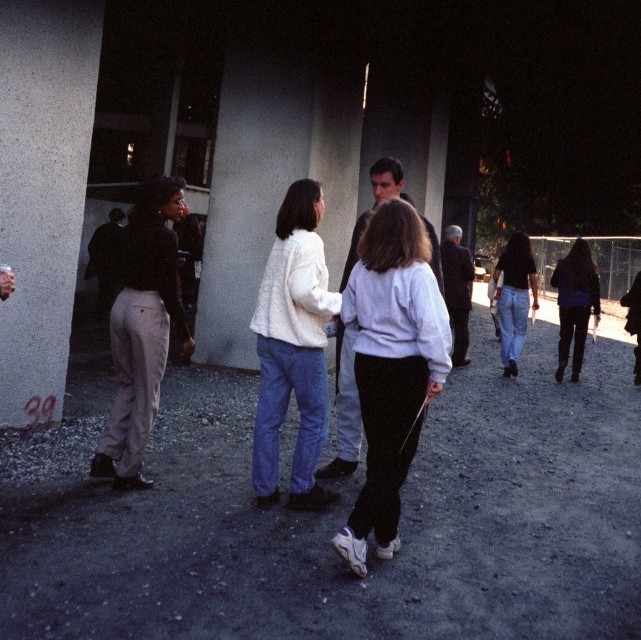
Locate an element on the screen. This screenshot has height=640, width=641. white sweater at center is located at coordinates (292, 349).

Looking at this image, is the position of white sweater at center more distant than that of dark purple sweater at right?

No, it is in front of dark purple sweater at right.

Who is more forward, (287, 333) or (567, 353)?

Positioned in front is point (287, 333).

You are a GUI agent. You are given a task and a screenshot of the screen. Output one action in this format:
    pyautogui.click(x=<x>, y=<y>)
    Task: Click on the white sweater at center
    
    Given the screenshot: What is the action you would take?
    pyautogui.click(x=292, y=349)

Between smooth gray sweater at center and dark gray suit at center, which one appears on the right side from the viewer's perspective?

dark gray suit at center is more to the right.

Looking at this image, can you confirm if smooth gray sweater at center is positioned to the right of dark gray suit at center?

In fact, smooth gray sweater at center is to the left of dark gray suit at center.

Measure the distance between point (394, 182) and camera.

Point (394, 182) is 4.98 meters from camera.

Locate an element on the screen. This screenshot has height=640, width=641. smooth gray sweater at center is located at coordinates (344, 410).

Is jeans at right smaller than dark gray suit at center?

Correct, jeans at right occupies less space than dark gray suit at center.

Which of these two, jeans at right or dark gray suit at center, stands shorter?

jeans at right is shorter.

Who is more distant from viewer, (508, 291) or (444, 282)?

Positioned behind is point (444, 282).

Where is `jeans at right`? jeans at right is located at coordinates (513, 298).